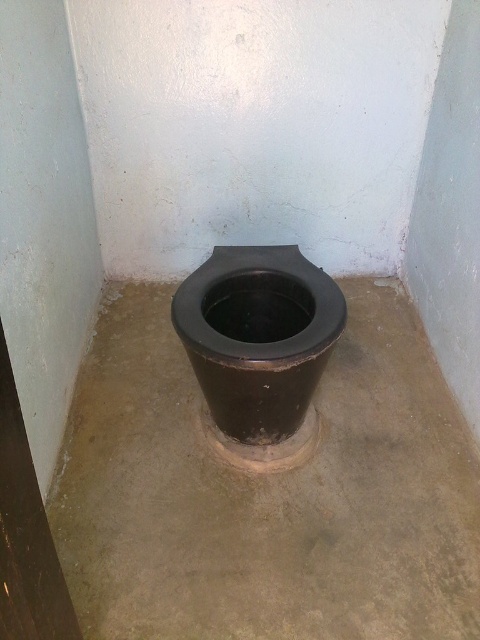
Does black matte cement at center appear on the right side of black matte toilet bowl at center?

Indeed, black matte cement at center is positioned on the right side of black matte toilet bowl at center.

Is black matte cement at center to the left of black matte toilet bowl at center from the viewer's perspective?

In fact, black matte cement at center is to the right of black matte toilet bowl at center.

Is point (93, 547) closer to camera compared to point (251, 307)?

Yes, point (93, 547) is in front of point (251, 307).

I want to click on black matte cement at center, so pos(267,492).